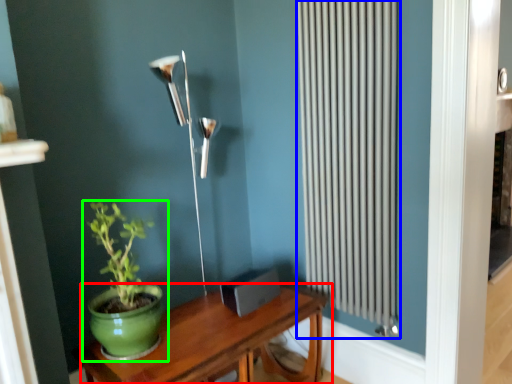
Question: Considering the real-world distances, which object is closest to table (highlighted by a red box)? radiator (highlighted by a blue box) or houseplant (highlighted by a green box).

Choices:
 (A) radiator
 (B) houseplant

Answer: (B)